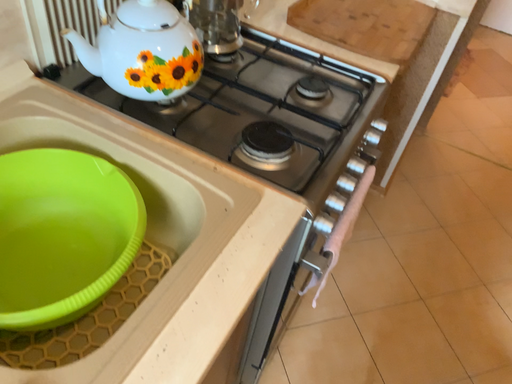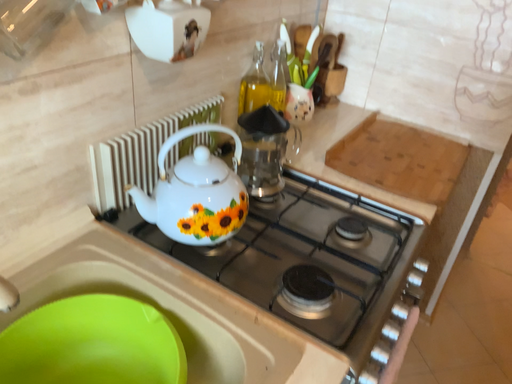
Question: How did the camera likely rotate when shooting the video?

Choices:
 (A) rotated upward
 (B) rotated downward

Answer: (A)